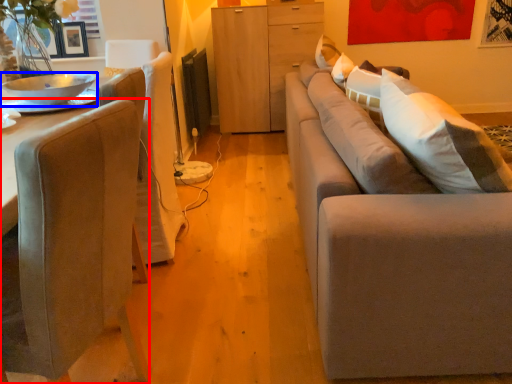
Question: Which object is further to the camera taking this photo, chair (highlighted by a red box) or bowl (highlighted by a blue box)?

Choices:
 (A) chair
 (B) bowl

Answer: (B)